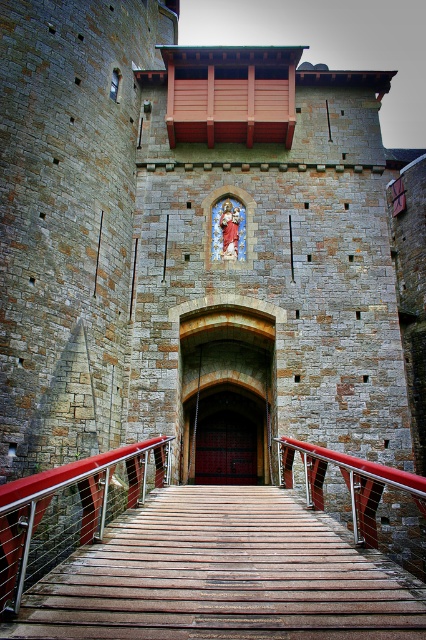
Question: In this image, where is wooden textured rail at center located relative to glass mosaic at center?

Choices:
 (A) above
 (B) below

Answer: (B)

Question: Does metallic red railing at center appear under glass mosaic at center?

Choices:
 (A) no
 (B) yes

Answer: (B)

Question: Based on their relative distances, which object is farther from the metallic red railing at center?

Choices:
 (A) glass mosaic at center
 (B) wooden textured rail at center

Answer: (A)

Question: Is metallic red railing at center in front of dark red wood door at center?

Choices:
 (A) yes
 (B) no

Answer: (A)

Question: Estimate the real-world distances between objects in this image. Which object is closer to the wooden textured rail at center?

Choices:
 (A) dark red wood door at center
 (B) glass mosaic at center

Answer: (A)

Question: Estimate the real-world distances between objects in this image. Which object is farther from the glass mosaic at center?

Choices:
 (A) wooden textured rail at center
 (B) dark red wood door at center
 (C) metallic red railing at center

Answer: (C)